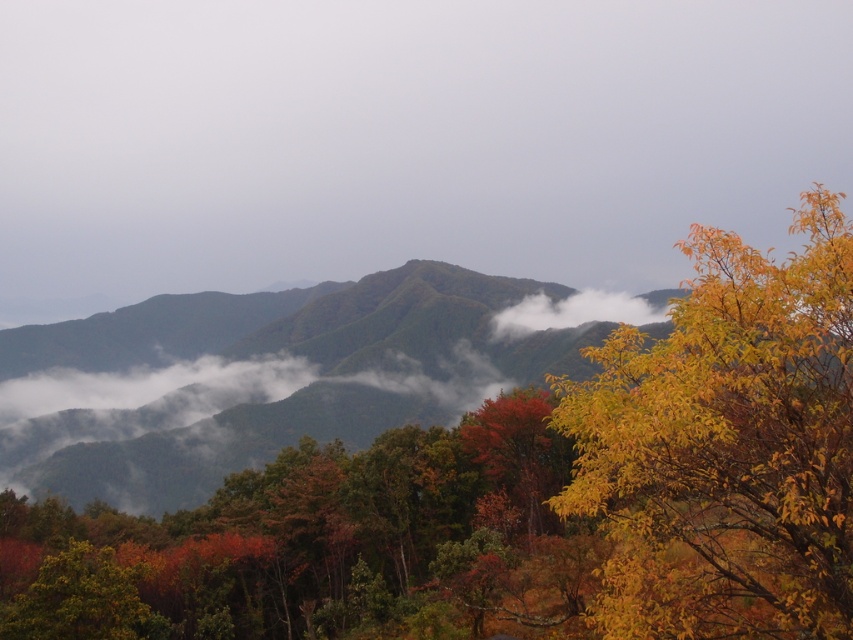
Question: Is white mist at center thinner than white fluffy cloud at center?

Choices:
 (A) no
 (B) yes

Answer: (A)

Question: Can you confirm if autumn foliage at center is wider than yellow leafy tree at right?

Choices:
 (A) no
 (B) yes

Answer: (B)

Question: Among these points, which one is nearest to the camera?

Choices:
 (A) (701, 588)
 (B) (294, 488)
 (C) (548, 324)
 (D) (619, 17)

Answer: (A)

Question: Which object is positioned closest to the yellow leafy tree at right?

Choices:
 (A) white fluffy cloud at center
 (B) autumn foliage at center
 (C) white mist at center
 (D) autumn leaves at center

Answer: (B)

Question: Among these points, which one is farthest from the camera?

Choices:
 (A) (805, 228)
 (B) (45, 605)

Answer: (B)

Question: Can you confirm if white mist at center is positioned below autumn foliage at center?

Choices:
 (A) yes
 (B) no

Answer: (B)